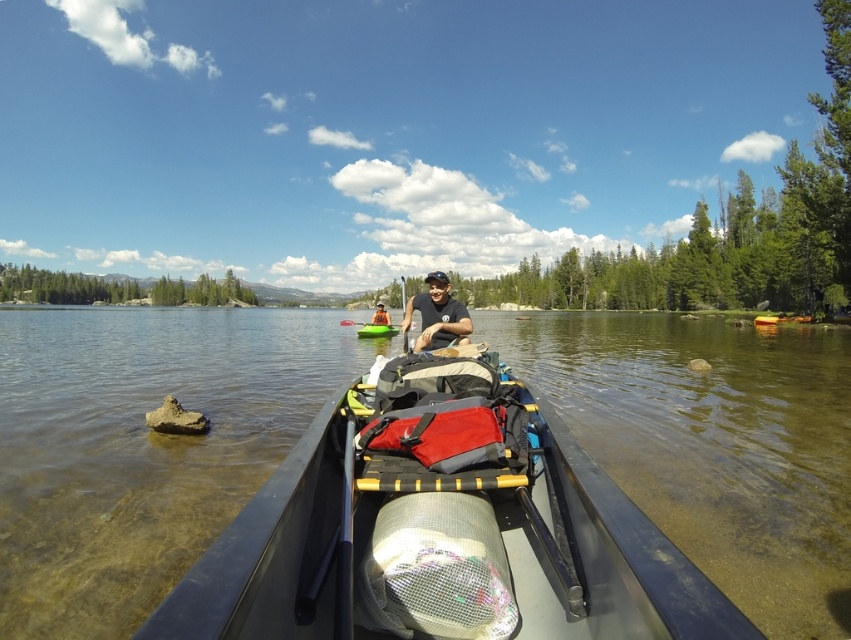
Who is more distant from viewer, (386, 312) or (343, 321)?

The point (343, 321) is more distant.

Which is in front, point (377, 310) or point (347, 321)?

Point (377, 310) is in front.

I want to click on orange life vest at center, so click(x=380, y=316).

Which of these two, black plastic canoe at center or orange life vest at center, stands shorter?

With less height is black plastic canoe at center.

Who is positioned more to the right, black plastic canoe at center or orange life vest at center?

black plastic canoe at center

What do you see at coordinates (443, 532) in the screenshot? I see `black plastic canoe at center` at bounding box center [443, 532].

Where is `black plastic canoe at center`? black plastic canoe at center is located at coordinates (443, 532).

Based on the photo, which is below, green plastic canoe at center or white plastic paddle at center?

green plastic canoe at center is below.

Between point (369, 328) and point (403, 342), which one is positioned behind?

The point (369, 328) is behind.

Between point (363, 328) and point (403, 340), which one is positioned in front?

Positioned in front is point (403, 340).

Locate an element on the screen. green plastic canoe at center is located at coordinates (377, 330).